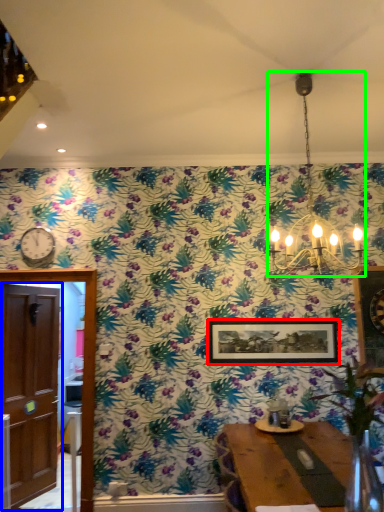
Question: Which object is positioned farthest from picture frame (highlighted by a red box)? Select from door (highlighted by a blue box) and light fixture (highlighted by a green box).

Choices:
 (A) door
 (B) light fixture

Answer: (A)